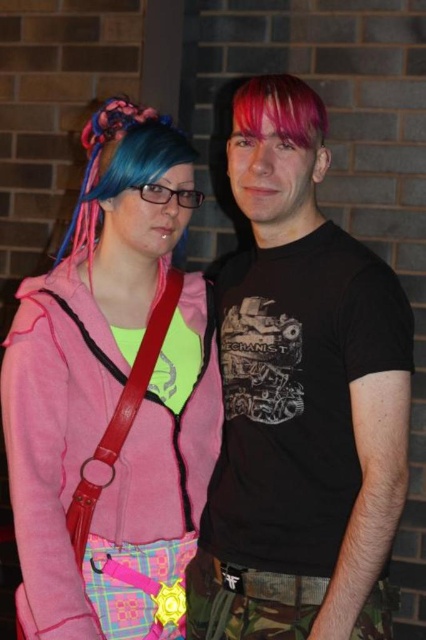
Question: Is the position of blue dyed hair at center less distant than that of pink matte hair at center?

Choices:
 (A) no
 (B) yes

Answer: (A)

Question: Does matte pink hoodie at center appear over pink matte hair at center?

Choices:
 (A) yes
 (B) no

Answer: (B)

Question: Which of the following is the closest to the observer?

Choices:
 (A) (158, 170)
 (B) (51, 353)
 (C) (232, 109)

Answer: (B)

Question: Can you confirm if black matte t-shirt at center is wider than pink matte hair at center?

Choices:
 (A) no
 (B) yes

Answer: (B)

Question: Which object is closer to the camera taking this photo?

Choices:
 (A) matte pink hoodie at center
 (B) blue dyed hair at center
 (C) black matte t-shirt at center
 (D) pink matte hair at center

Answer: (C)

Question: Which of the following is the farthest from the observer?

Choices:
 (A) black matte t-shirt at center
 (B) blue dyed hair at center
 (C) pink matte hair at center
 (D) matte pink hoodie at center

Answer: (B)